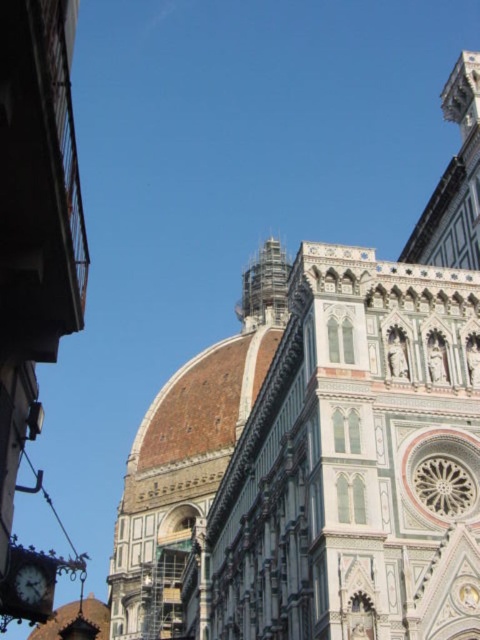
Is brown tiled dome at center bigger than matte black clock at lower left?

Yes, brown tiled dome at center is bigger than matte black clock at lower left.

Which of these two, brown tiled dome at center or matte black clock at lower left, stands shorter?

matte black clock at lower left is shorter.

The width and height of the screenshot is (480, 640). What do you see at coordinates (323, 444) in the screenshot?
I see `brown tiled dome at center` at bounding box center [323, 444].

What are the coordinates of `brown tiled dome at center` in the screenshot? It's located at pos(323,444).